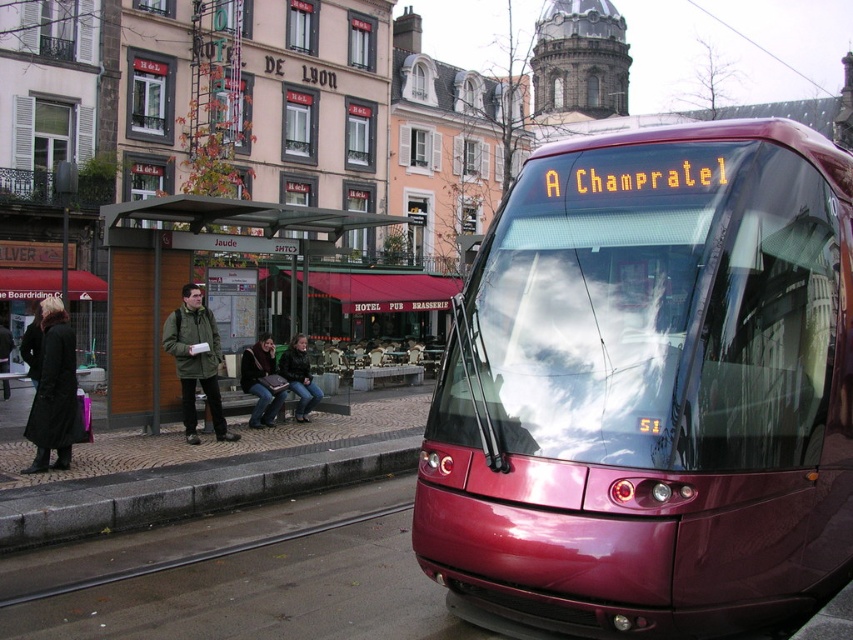
You are a pedestrian standing at the tram stop shelter labeled Jaude and want to walk to the gray concrete curb at lower left. Which direction should you move relative to the green matte jacket at left?

The gray concrete curb at lower left is positioned on the right side of the green matte jacket at left, so you should move to the right of the green matte jacket at left to reach it.

You are a photographer trying to capture both the shiny maroon tram at center and the dark brown leather jacket at center in the same frame. Which object should you focus on first to ensure both are in the frame?

The shiny maroon tram at center is bigger than the dark brown leather jacket at center, so you should focus on the shiny maroon tram at center first to ensure both fit in the frame.

You are a delivery person who needs to load a package onto a truck parked behind the shiny maroon tram at center. The truck requires the package to be placed on a platform that is as tall as the gray concrete curb at lower left. Can the delivery person place the package directly on the platform without any adjustments?

The shiny maroon tram at center is taller than the gray concrete curb at lower left. Since the platform is as tall as the curb, the tram might block access to the platform. However, the question is about the height of the platform versus the package placement. The package can be placed directly on the platform because the tram height doesn